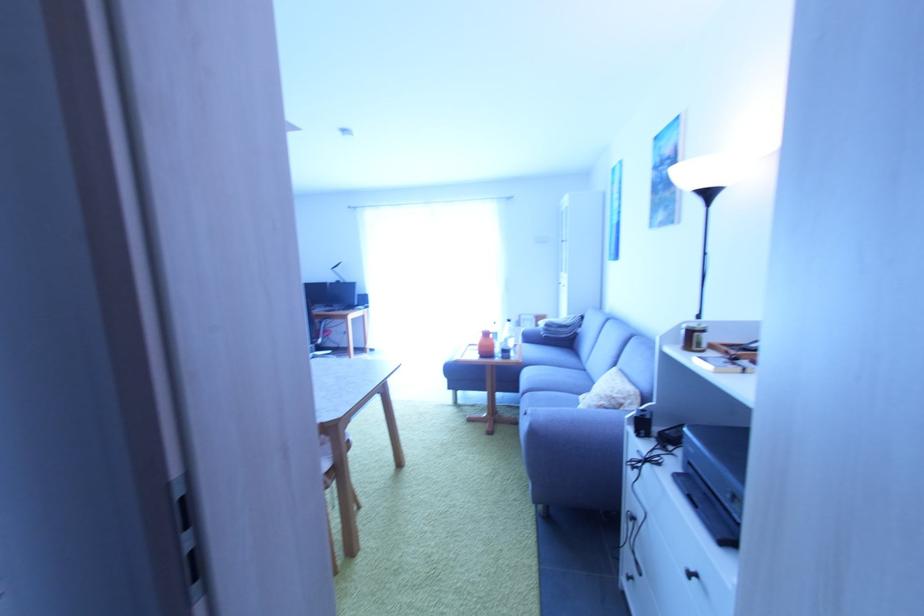
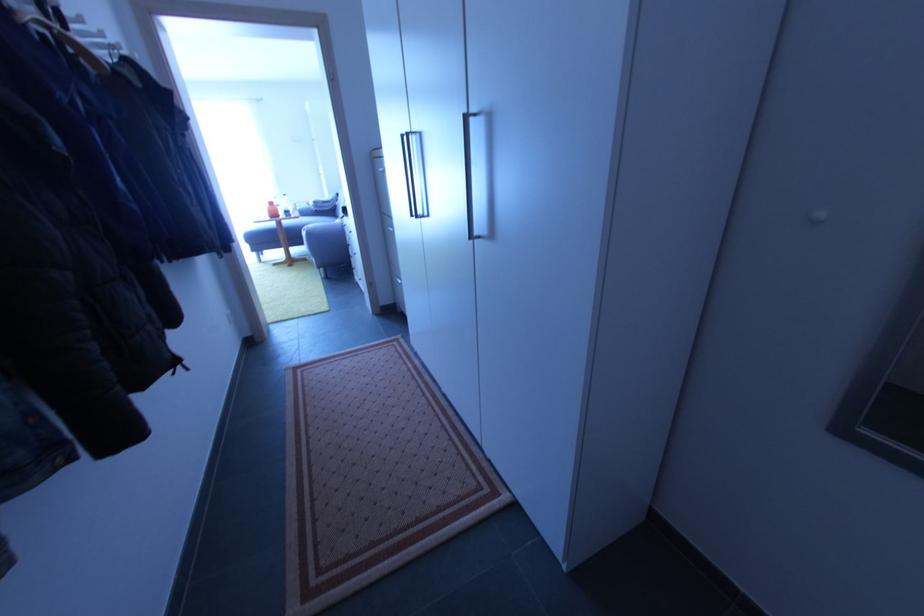
Question: I am providing you with two images of the same scene from different viewpoints. Which of the following objects are not visible in image2?

Choices:
 (A) orange bottle
 (B) green power button
 (C) black drawer handle
 (D) sofa armrest

Answer: (C)